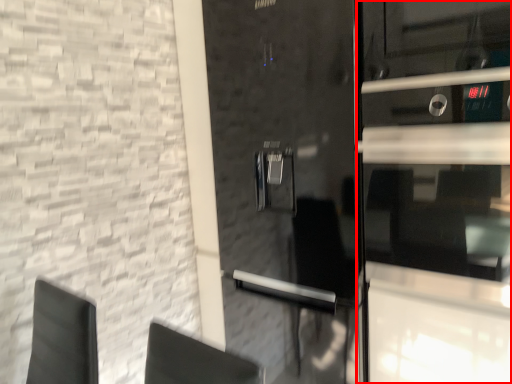
Question: Observing the image, what is the correct spatial positioning of glass door (annotated by the red box) in reference to door?

Choices:
 (A) left
 (B) right

Answer: (B)